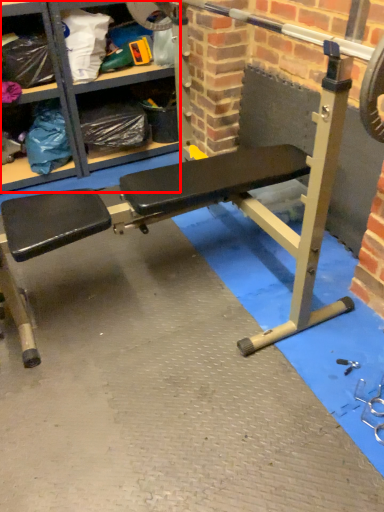
Question: Observing the image, what is the correct spatial positioning of shelf (annotated by the red box) in reference to barbell?

Choices:
 (A) left
 (B) right

Answer: (A)